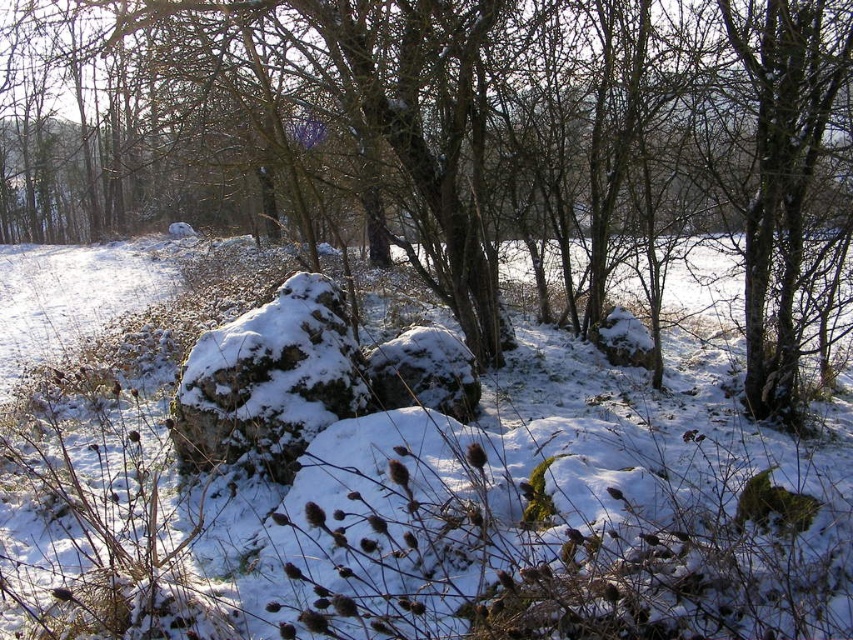
Question: Can you confirm if brown rough tree at center is positioned below white fluffy snow at center?

Choices:
 (A) no
 (B) yes

Answer: (A)

Question: Is brown rough tree at center wider than white fluffy snow at center?

Choices:
 (A) no
 (B) yes

Answer: (B)

Question: Can you confirm if brown rough tree at center is positioned above white fluffy snow at center?

Choices:
 (A) no
 (B) yes

Answer: (B)

Question: Which point is farther to the camera?

Choices:
 (A) white fluffy snow at center
 (B) brown rough tree at center

Answer: (B)